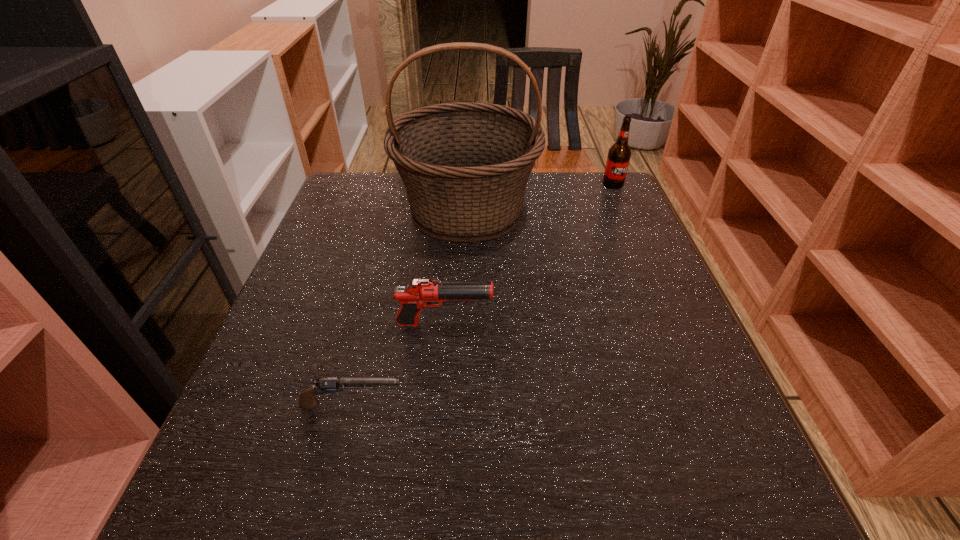
The width and height of the screenshot is (960, 540). I want to click on vacant space at the near left corner of the desktop, so click(252, 524).

Find the location of `vacant space at the far right corner`. vacant space at the far right corner is located at coordinates (584, 196).

Locate an element on the screen. The width and height of the screenshot is (960, 540). free space between the third shortest object and the tallest object is located at coordinates (540, 198).

At what (x,y) coordinates should I click in order to perform the action: click on vacant point located between the third tallest object and the shorter gun. Please return your answer as a coordinate pair (x, y). The width and height of the screenshot is (960, 540). Looking at the image, I should click on click(398, 364).

This screenshot has height=540, width=960. I want to click on free space between the third farthest object and the root beer, so click(529, 254).

The width and height of the screenshot is (960, 540). I want to click on empty location between the taller gun and the rightmost object, so [x=529, y=254].

Locate an element on the screen. This screenshot has width=960, height=540. unoccupied position between the third shortest object and the tallest object is located at coordinates (540, 198).

What are the coordinates of `free space between the third tallest object and the tallest object` in the screenshot? It's located at (456, 267).

Find the location of a particular element. object that is the third closest one to the nearest object is located at coordinates click(618, 159).

Select which object is the second closest to the tallest object. Please provide its 2D coordinates. Your answer should be formatted as a tuple, i.e. [(x, y)], where the tuple contains the x and y coordinates of a point satisfying the conditions above.

[(618, 159)]